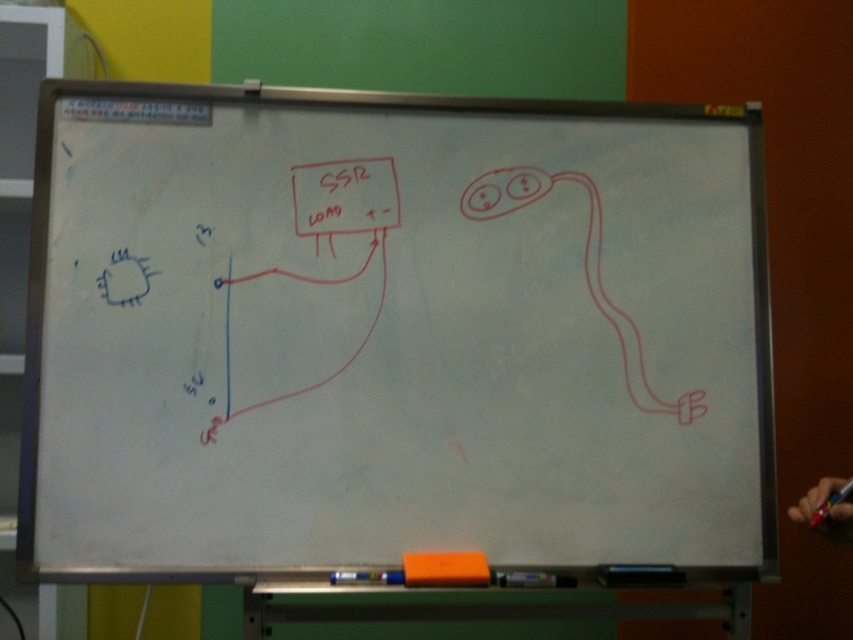
Question: Where is white matte board at center located in relation to black matte pen at lower center in the image?

Choices:
 (A) below
 (B) above

Answer: (B)

Question: Does white matte board at center appear over black matte pen at lower center?

Choices:
 (A) yes
 (B) no

Answer: (A)

Question: Which point is farther to the camera?

Choices:
 (A) white matte board at center
 (B) black matte pen at lower center

Answer: (B)

Question: Among these objects, which one is nearest to the camera?

Choices:
 (A) black matte pen at lower center
 (B) white matte board at center

Answer: (B)

Question: Is white matte board at center closer to camera compared to black matte pen at lower center?

Choices:
 (A) no
 (B) yes

Answer: (B)